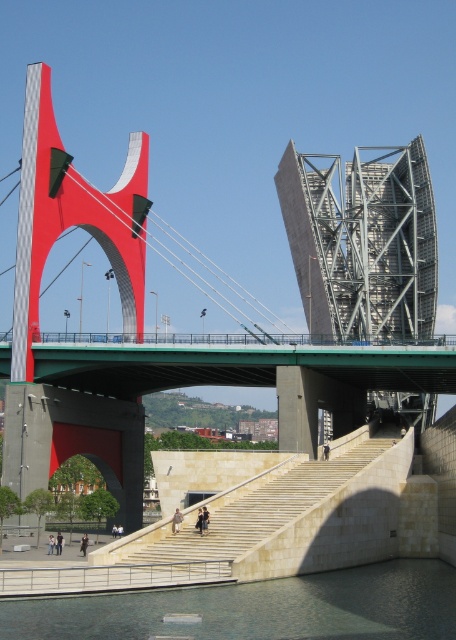
Question: From the image, what is the correct spatial relationship of dark green water at lower center in relation to light beige stone stairs at center?

Choices:
 (A) right
 (B) left

Answer: (B)

Question: Is dark green water at lower center positioned before light beige stone stairs at center?

Choices:
 (A) yes
 (B) no

Answer: (A)

Question: Does dark green water at lower center appear under light beige stone stairs at center?

Choices:
 (A) no
 (B) yes

Answer: (B)

Question: Which of the following is the farthest from the observer?

Choices:
 (A) (244, 576)
 (B) (32, 628)

Answer: (A)